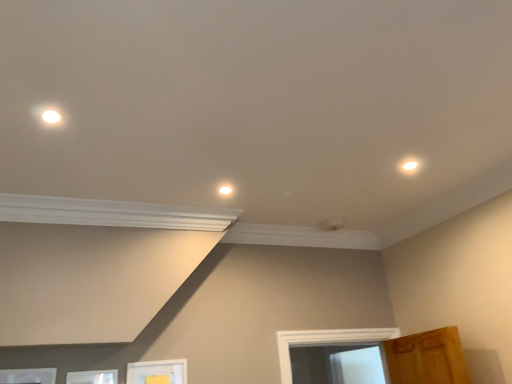
Question: Looking at their shapes, would you say white matte picture frame at lower left, acting as the 3th picture frame starting from the right, is wider or thinner than white glossy light fixture at center, the first dot in the left-to-right sequence?

Choices:
 (A) thin
 (B) wide

Answer: (A)

Question: Do you think white matte picture frame at lower left, the 1th picture frame when ordered from left to right, is within white glossy light fixture at center, the 1th dot when ordered from bottom to top, or outside of it?

Choices:
 (A) inside
 (B) outside

Answer: (B)

Question: Which is nearer to the white matte picture frame at lower left, acting as the second picture frame starting from the left?

Choices:
 (A) white matte picture frame at lower center, which appears as the 3th picture frame when viewed from the left
 (B) white matte picture frame at lower left, acting as the 3th picture frame starting from the right
 (C) white glossy light fixture at upper right, which is the 1th dot in right-to-left order
 (D) white glossy light fixture at center, the 2th dot from the top

Answer: (B)

Question: Estimate the real-world distances between objects in this image. Which object is closer to the white matte picture frame at lower left, the 1th picture frame when ordered from left to right?

Choices:
 (A) white matte picture frame at lower center, the first picture frame viewed from the right
 (B) white glossy light fixture at upper right, which appears as the 2th dot when ordered from the bottom
 (C) white matte picture frame at lower left, arranged as the 2th picture frame when viewed from the right
 (D) white glossy light fixture at center, the 1th dot when ordered from bottom to top

Answer: (C)